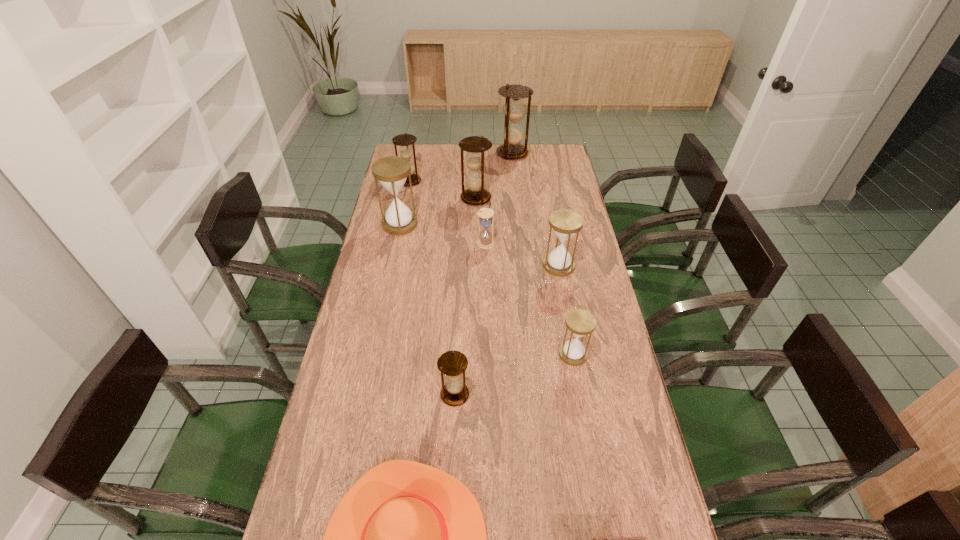
The height and width of the screenshot is (540, 960). I want to click on the tallest hourglass, so click(515, 109).

This screenshot has height=540, width=960. I want to click on the tallest object, so click(x=515, y=109).

Locate an element on the screen. Image resolution: width=960 pixels, height=540 pixels. the third farthest hourglass is located at coordinates (475, 146).

Where is `the eighth nearest object`? The width and height of the screenshot is (960, 540). the eighth nearest object is located at coordinates (475, 146).

Image resolution: width=960 pixels, height=540 pixels. In order to click on the biggest white hourglass in this screenshot , I will do `click(392, 172)`.

Locate an element on the screen. The height and width of the screenshot is (540, 960). the ninth nearest object is located at coordinates (405, 141).

This screenshot has height=540, width=960. In order to click on the seventh nearest hourglass in this screenshot , I will do click(405, 141).

Find the location of `the third smallest white hourglass`. the third smallest white hourglass is located at coordinates coord(565,223).

The image size is (960, 540). I want to click on the third farthest white hourglass, so click(x=565, y=223).

Where is `the second white hourglass from left to right`? This screenshot has width=960, height=540. the second white hourglass from left to right is located at coordinates (485, 241).